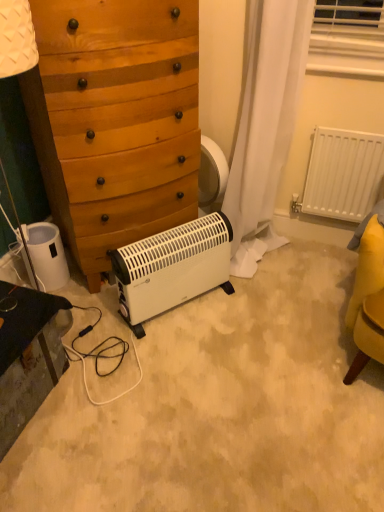
Question: In terms of width, does wooden chest of drawers at center look wider or thinner when compared to black glossy vanity at lower left?

Choices:
 (A) wide
 (B) thin

Answer: (A)

Question: Based on their sizes in the image, would you say wooden chest of drawers at center is bigger or smaller than black glossy vanity at lower left?

Choices:
 (A) small
 (B) big

Answer: (B)

Question: Which of these objects is positioned closest to the white matte heater at center?

Choices:
 (A) white plastic radiator at right
 (B) white plastic heater at lower left
 (C) wooden chest of drawers at center
 (D) black glossy vanity at lower left

Answer: (C)

Question: Which is nearer to the white matte heater at center?

Choices:
 (A) white plastic heater at lower left
 (B) wooden chest of drawers at center
 (C) white plastic radiator at right
 (D) black glossy vanity at lower left

Answer: (B)